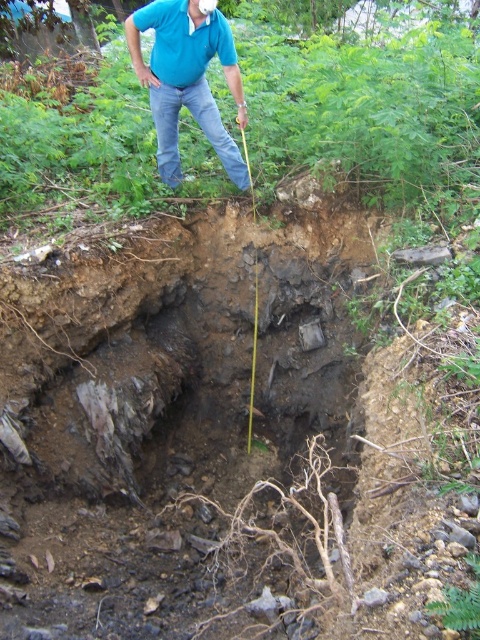
Which is below, blue cotton shirt at upper center or blue cotton polo shirt at upper center?

blue cotton shirt at upper center is lower down.

Does blue cotton shirt at upper center come in front of blue cotton polo shirt at upper center?

Yes.

Is point (169, 157) positioned in front of point (165, 8)?

That is False.

The image size is (480, 640). Find the location of `blue cotton shirt at upper center`. blue cotton shirt at upper center is located at coordinates (187, 77).

Can you confirm if blue cotton shirt at upper center is positioned above jeans at upper center?

Yes.

Does blue cotton shirt at upper center have a smaller size compared to jeans at upper center?

No, blue cotton shirt at upper center is not smaller than jeans at upper center.

Where is `blue cotton shirt at upper center`? blue cotton shirt at upper center is located at coordinates (187, 77).

Find the location of a particular element. Image resolution: width=480 pixels, height=640 pixels. blue cotton shirt at upper center is located at coordinates (187, 77).

Which is more to the left, blue cotton polo shirt at upper center or jeans at upper center?

blue cotton polo shirt at upper center is more to the left.

Does blue cotton polo shirt at upper center appear on the right side of jeans at upper center?

No, blue cotton polo shirt at upper center is not to the right of jeans at upper center.

I want to click on blue cotton polo shirt at upper center, so click(183, 40).

In order to click on blue cotton polo shirt at upper center in this screenshot , I will do `click(183, 40)`.